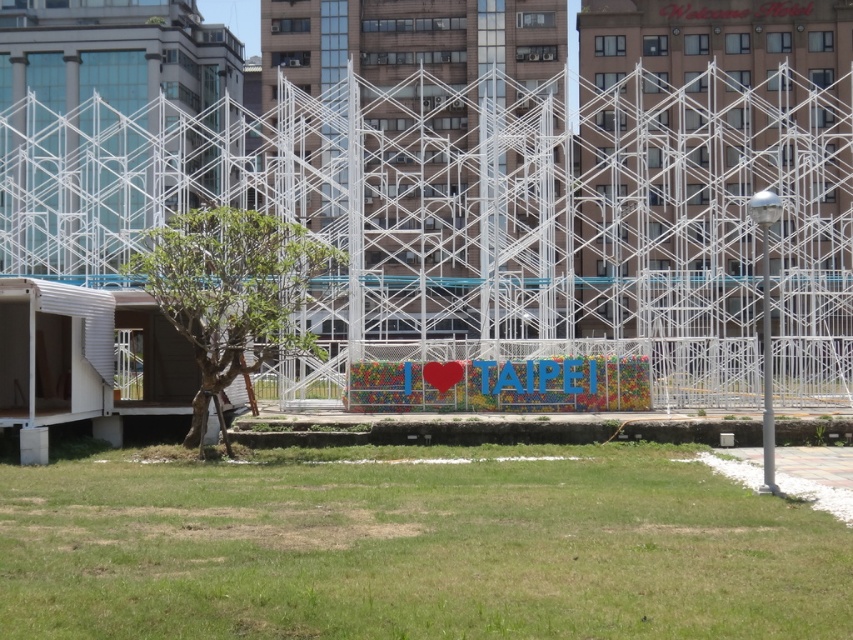
Is green grass at lower center shorter than green leafy tree at left?

Correct, green grass at lower center is not as tall as green leafy tree at left.

Which is above, green grass at lower center or green leafy tree at left?

green leafy tree at left is higher up.

In order to click on green grass at lower center in this screenshot , I will do `click(415, 547)`.

Is white metallic scaffolding at center bigger than green grass at lower center?

Correct, white metallic scaffolding at center is larger in size than green grass at lower center.

Is white metallic scaffolding at center to the right of green grass at lower center from the viewer's perspective?

Correct, you'll find white metallic scaffolding at center to the right of green grass at lower center.

Locate an element on the screen. The image size is (853, 640). white metallic scaffolding at center is located at coordinates (488, 218).

This screenshot has width=853, height=640. Identify the location of white metallic scaffolding at center. [x=488, y=218].

Can you confirm if white metallic scaffolding at center is positioned above green leafy tree at left?

Yes.

Is point (810, 342) positioned behind point (271, 333)?

Yes, point (810, 342) is farther from viewer.

The width and height of the screenshot is (853, 640). I want to click on white metallic scaffolding at center, so click(488, 218).